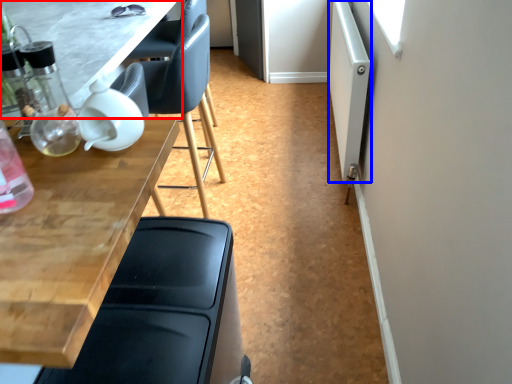
Question: Which object appears farthest to the camera in this image, table (highlighted by a red box) or screen door (highlighted by a blue box)?

Choices:
 (A) table
 (B) screen door

Answer: (B)